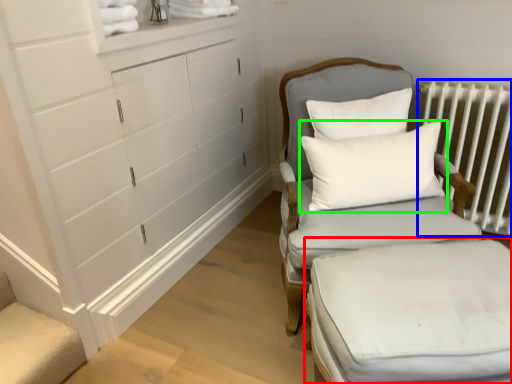
Question: Based on their relative distances, which object is nearer to changing table (highlighted by a red box)? Choose from radiator (highlighted by a blue box) and pillow (highlighted by a green box).

Choices:
 (A) radiator
 (B) pillow

Answer: (B)